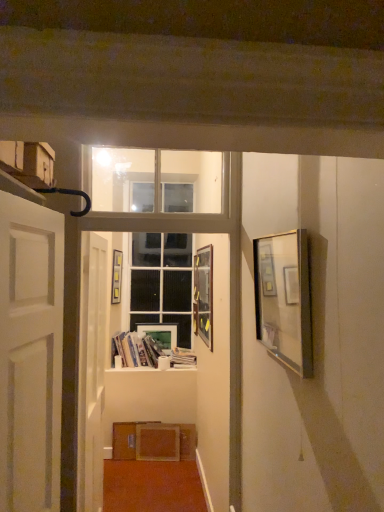
Question: Can you confirm if white glossy door at center, the first door when ordered from back to front, is smaller than white matte door at left, which appears as the 1th door when viewed from the front?

Choices:
 (A) no
 (B) yes

Answer: (A)

Question: Considering the relative positions of white glossy door at center, which is counted as the 2th door, starting from the front, and white matte door at left, which ranks as the second door in back-to-front order, in the image provided, is white glossy door at center, which is counted as the 2th door, starting from the front, to the left of white matte door at left, which ranks as the second door in back-to-front order, from the viewer's perspective?

Choices:
 (A) no
 (B) yes

Answer: (B)

Question: Does white glossy door at center, the first door when ordered from back to front, have a lesser width compared to white matte door at left, which ranks as the second door in back-to-front order?

Choices:
 (A) yes
 (B) no

Answer: (A)

Question: Considering the relative positions of white glossy door at center, which is counted as the 2th door, starting from the front, and white matte door at left, which ranks as the second door in back-to-front order, in the image provided, is white glossy door at center, which is counted as the 2th door, starting from the front, behind white matte door at left, which ranks as the second door in back-to-front order,?

Choices:
 (A) no
 (B) yes

Answer: (B)

Question: Is white glossy door at center, the first door when ordered from back to front, far from white matte door at left, which appears as the 1th door when viewed from the front?

Choices:
 (A) no
 (B) yes

Answer: (A)

Question: In terms of height, does matte cardboard box at upper left look taller or shorter compared to clear glass window frame at upper center?

Choices:
 (A) tall
 (B) short

Answer: (B)

Question: Is matte cardboard box at upper left situated inside clear glass window frame at upper center or outside?

Choices:
 (A) outside
 (B) inside

Answer: (A)

Question: Considering the positions of matte cardboard box at upper left and clear glass window frame at upper center in the image, is matte cardboard box at upper left wider or thinner than clear glass window frame at upper center?

Choices:
 (A) wide
 (B) thin

Answer: (B)

Question: Considering the positions of point (46, 145) and point (233, 169), is point (46, 145) closer or farther from the camera than point (233, 169)?

Choices:
 (A) closer
 (B) farther

Answer: (A)

Question: Do you think matte cardboard box at upper left is within matte white picture frame at center, the first picture frame when ordered from back to front, or outside of it?

Choices:
 (A) inside
 (B) outside

Answer: (B)

Question: Is point (11, 147) positioned closer to the camera than point (162, 330)?

Choices:
 (A) closer
 (B) farther

Answer: (A)

Question: In terms of size, does matte cardboard box at upper left appear bigger or smaller than matte white picture frame at center, positioned as the fourth picture frame in front-to-back order?

Choices:
 (A) small
 (B) big

Answer: (B)

Question: From a real-world perspective, is matte cardboard box at upper left above or below matte white picture frame at center, the 2th picture frame viewed from the left?

Choices:
 (A) above
 (B) below

Answer: (A)

Question: Is white glass door at center to the left or to the right of white glossy door at center, the first door when ordered from back to front, in the image?

Choices:
 (A) left
 (B) right

Answer: (B)

Question: From their relative heights in the image, would you say white glass door at center is taller or shorter than white glossy door at center, the first door when ordered from back to front?

Choices:
 (A) tall
 (B) short

Answer: (B)